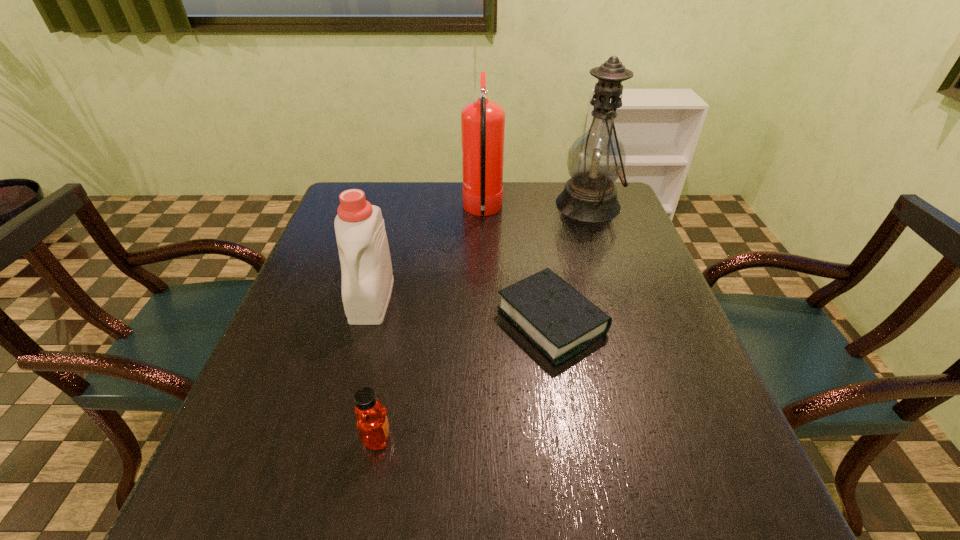
Identify the location of blank area located 0.230m towards the nozzle of the fire extinguisher. The width and height of the screenshot is (960, 540). (385, 212).

Locate an element on the screen. vacant region located on the handle side of the leftmost object is located at coordinates (349, 380).

Find the location of `vacant space located 0.160m on the front label of the honey`. vacant space located 0.160m on the front label of the honey is located at coordinates (486, 437).

At what (x,y) coordinates should I click in order to perform the action: click on vacant space located on the right of the shortest object. Please return your answer as a coordinate pair (x, y). Looking at the image, I should click on (642, 321).

Locate an element on the screen. This screenshot has height=540, width=960. oil lamp located at the far edge is located at coordinates (596, 159).

Identify the location of fire extinguisher that is at the far edge. This screenshot has width=960, height=540. (482, 122).

Locate an element on the screen. object positioned at the left edge is located at coordinates (367, 278).

Where is `oil lamp present at the right edge`? Image resolution: width=960 pixels, height=540 pixels. oil lamp present at the right edge is located at coordinates click(596, 159).

In order to click on Bible at the right edge in this screenshot , I will do `click(553, 315)`.

At what (x,y) coordinates should I click in order to perform the action: click on object located at the far right corner. Please return your answer as a coordinate pair (x, y). Image resolution: width=960 pixels, height=540 pixels. Looking at the image, I should click on (596, 159).